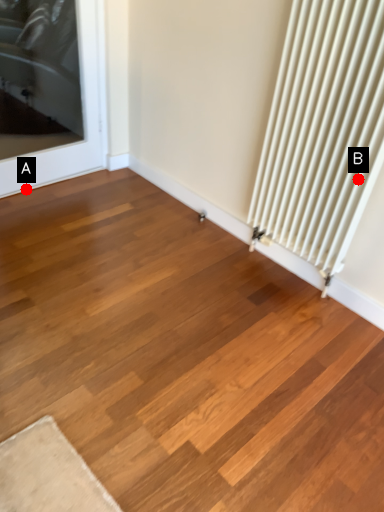
Question: Two points are circled on the image, labeled by A and B beside each circle. Which point is closer to the camera?

Choices:
 (A) A is closer
 (B) B is closer

Answer: (B)